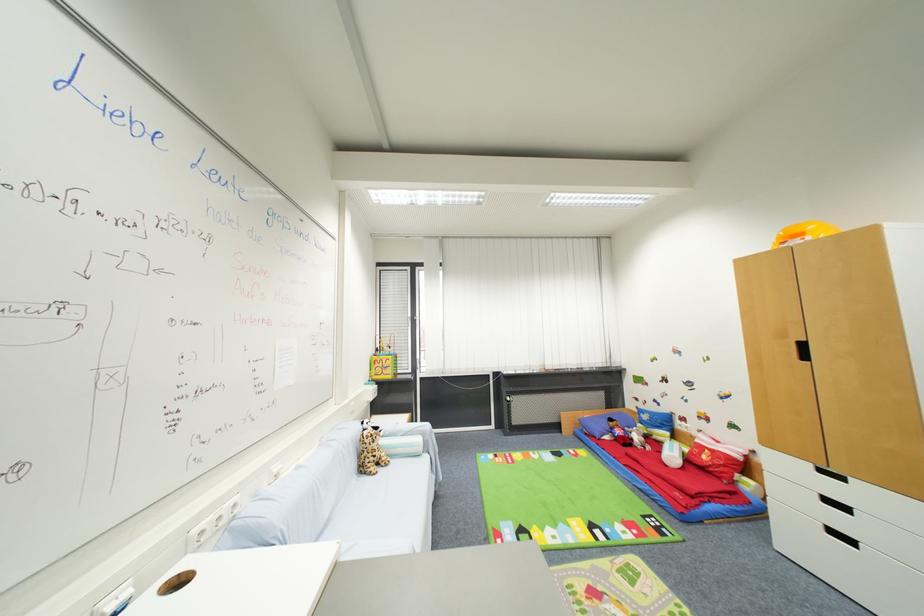
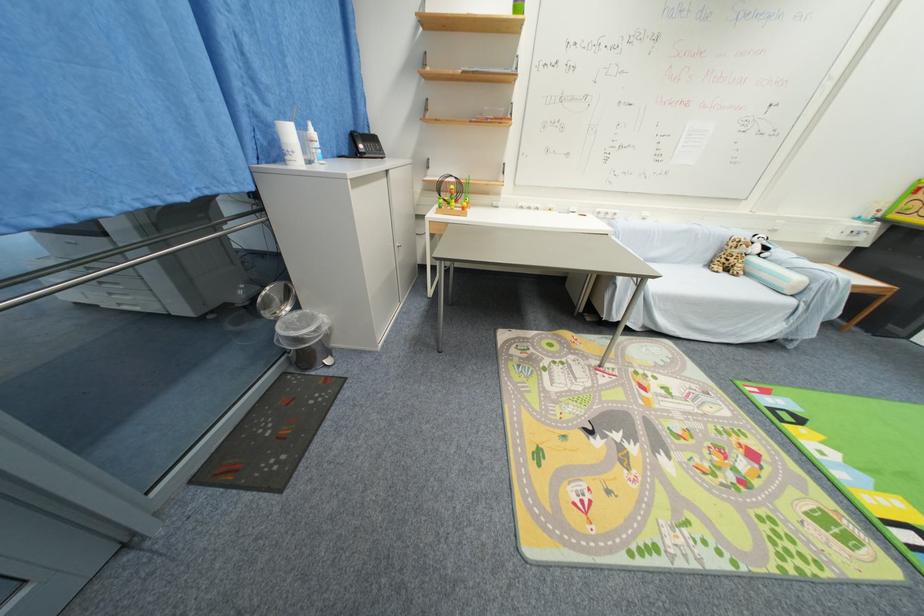
Find the pixel in the second image that matches pixel 385 472 in the first image.

(730, 276)